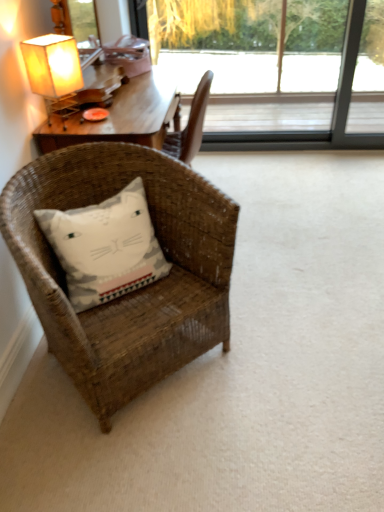
Question: From the image's perspective, is woven brown chair at lower left positioned above or below matte paper lampshade at upper left?

Choices:
 (A) above
 (B) below

Answer: (B)

Question: Is woven brown chair at lower left to the left or to the right of matte paper lampshade at upper left in the image?

Choices:
 (A) right
 (B) left

Answer: (A)

Question: Estimate the real-world distances between objects in this image. Which object is closer to the white cotton pillow with cat design at lower left?

Choices:
 (A) woven brown chair at lower left
 (B) transparent glass window at upper center
 (C) matte paper lampshade at upper left

Answer: (A)

Question: Which object is positioned farthest from the white cotton pillow with cat design at lower left?

Choices:
 (A) transparent glass window at upper center
 (B) woven brown chair at lower left
 (C) matte paper lampshade at upper left

Answer: (A)